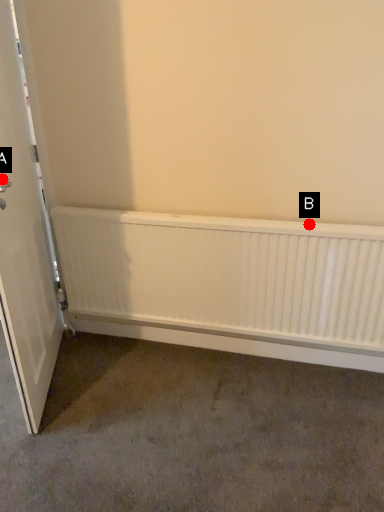
Question: Two points are circled on the image, labeled by A and B beside each circle. Which point is closer to the camera?

Choices:
 (A) A is closer
 (B) B is closer

Answer: (A)